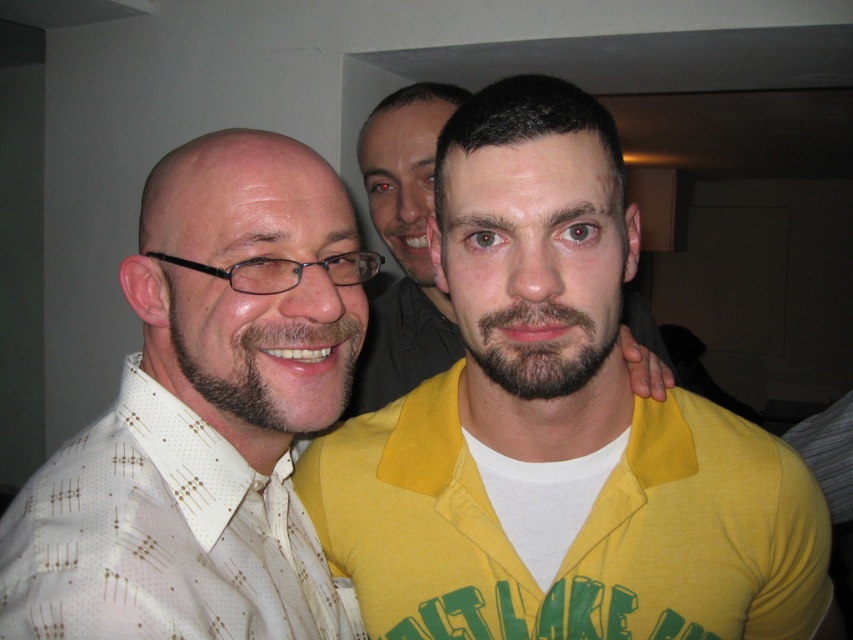
Question: Which object is the farthest from the brownsoftbeard at left?

Choices:
 (A) dark brown fuzzy beard at center
 (B) yellow matte shirt at center

Answer: (B)

Question: Which of the following is the farthest from the observer?

Choices:
 (A) matte yellow shirt at center
 (B) brownsoftbeard at left
 (C) dark brown fuzzy beard at center
 (D) white dotted fabric shirt at left

Answer: (A)

Question: Where is yellow matte shirt at center located in relation to white dotted fabric shirt at left in the image?

Choices:
 (A) above
 (B) below

Answer: (B)

Question: Is the position of yellow matte shirt at center less distant than that of white dotted fabric shirt at left?

Choices:
 (A) yes
 (B) no

Answer: (B)

Question: Does yellow matte shirt at center have a larger size compared to white dotted fabric shirt at left?

Choices:
 (A) no
 (B) yes

Answer: (B)

Question: Which is nearer to the brownsoftbeard at left?

Choices:
 (A) yellow matte shirt at center
 (B) white dotted fabric shirt at left

Answer: (B)